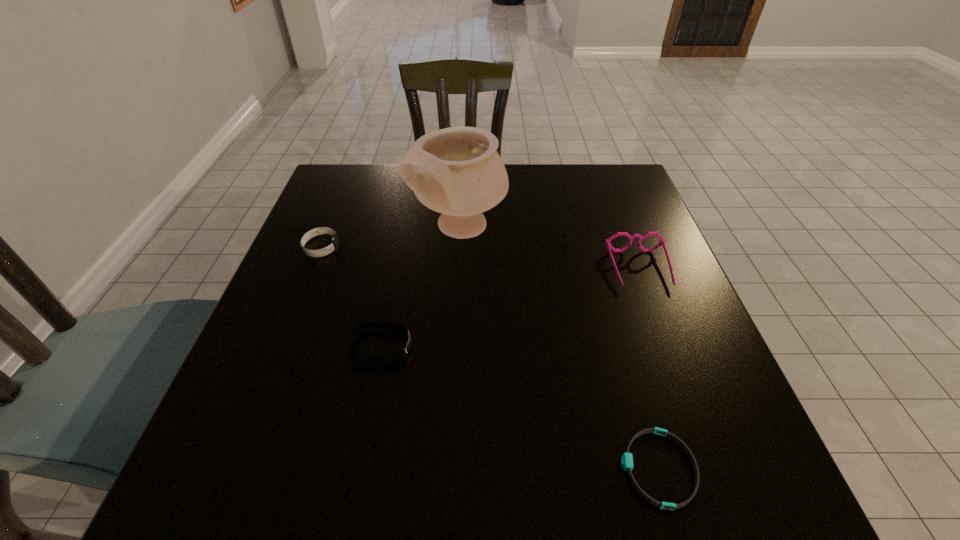
Identify the location of vacant region that satisfies the following two spatial constraints: 1. on the front side of the pottery; 2. on the display of the second wristband from left to right. Image resolution: width=960 pixels, height=540 pixels. (454, 347).

Find the location of a particular element. free space that satisfies the following two spatial constraints: 1. on the arms of the second tallest object; 2. on the buckle of the shortest wristband is located at coordinates (714, 468).

At what (x,y) coordinates should I click in order to perform the action: click on vacant space that satisfies the following two spatial constraints: 1. on the arms of the spectacles; 2. on the display of the second tallest wristband. Please return your answer as a coordinate pair (x, y). Looking at the image, I should click on (668, 347).

You are a GUI agent. You are given a task and a screenshot of the screen. Output one action in this format:
    pyautogui.click(x=<x>, y=<y>)
    Task: Click on the vacant space that satisfies the following two spatial constraints: 1. on the arms of the spectacles; 2. on the buckle of the shortest object
    
    Given the screenshot: What is the action you would take?
    pyautogui.click(x=714, y=468)